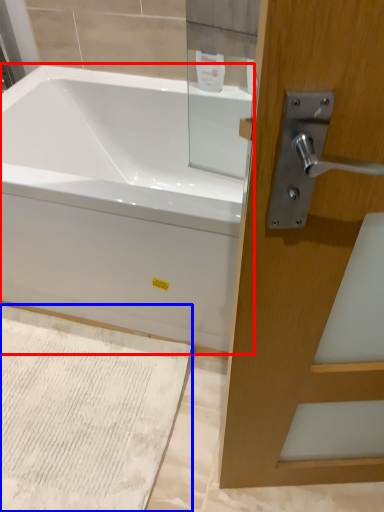
Question: Which point is closer to the camera, bathtub (highlighted by a red box) or bath mat (highlighted by a blue box)?

Choices:
 (A) bathtub
 (B) bath mat

Answer: (A)